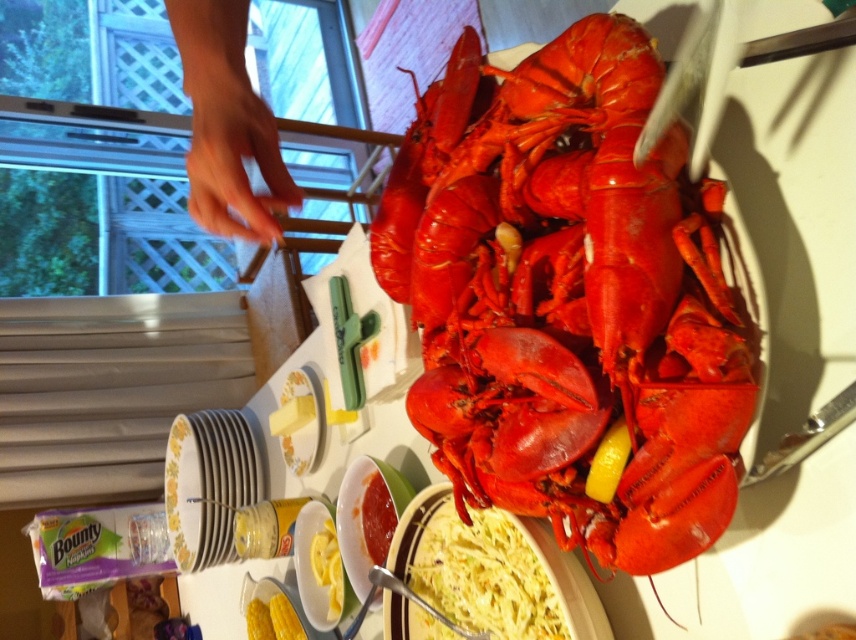
Is shiny red lobster at center behind skinny hand at upper center?

Yes, shiny red lobster at center is behind skinny hand at upper center.

What do you see at coordinates (568, 298) in the screenshot? I see `shiny red lobster at center` at bounding box center [568, 298].

I want to click on shiny red lobster at center, so click(568, 298).

Which is more to the left, shiny red lobster at center or smooth creamy pasta at center?

smooth creamy pasta at center

Does shiny red lobster at center appear on the right side of smooth creamy pasta at center?

Yes, shiny red lobster at center is to the right of smooth creamy pasta at center.

Image resolution: width=856 pixels, height=640 pixels. Describe the element at coordinates (568, 298) in the screenshot. I see `shiny red lobster at center` at that location.

This screenshot has height=640, width=856. I want to click on shiny red lobster at center, so click(x=568, y=298).

Can you confirm if skinny hand at upper center is positioned to the right of smooth creamy pasta at center?

Incorrect, skinny hand at upper center is not on the right side of smooth creamy pasta at center.

Is point (242, 132) closer to viewer compared to point (498, 620)?

That is True.

You are a GUI agent. You are given a task and a screenshot of the screen. Output one action in this format:
    pyautogui.click(x=<x>, y=<y>)
    Task: Click on the skinny hand at upper center
    Image resolution: width=856 pixels, height=640 pixels.
    Given the screenshot: What is the action you would take?
    pyautogui.click(x=227, y=124)

This screenshot has width=856, height=640. I want to click on skinny hand at upper center, so click(x=227, y=124).